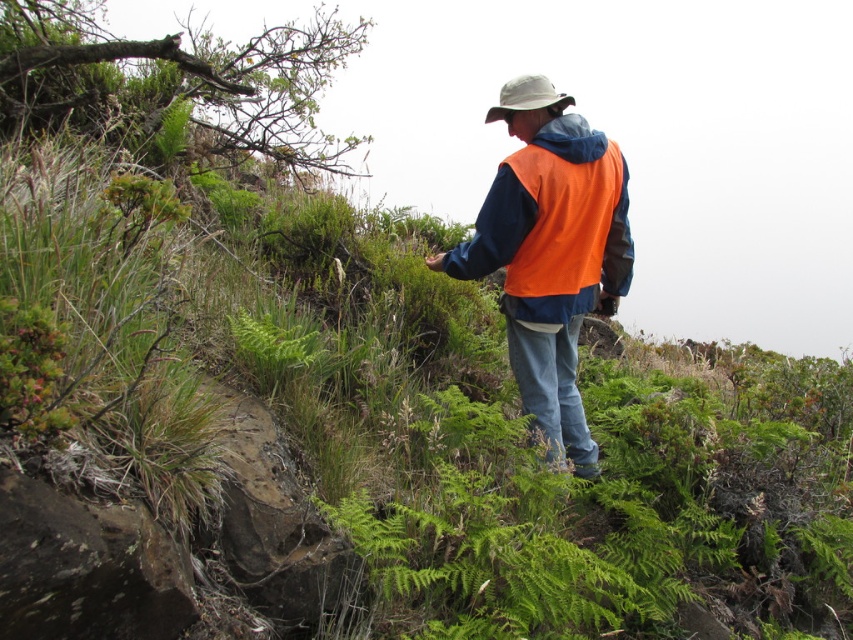
Who is positioned more to the left, orange fleece vest at center or khaki fabric hat at center?

From the viewer's perspective, khaki fabric hat at center appears more on the left side.

The width and height of the screenshot is (853, 640). Describe the element at coordinates (550, 252) in the screenshot. I see `orange fleece vest at center` at that location.

Identify the location of orange fleece vest at center. (550, 252).

Locate an element on the screen. This screenshot has width=853, height=640. orange fleece vest at center is located at coordinates (550, 252).